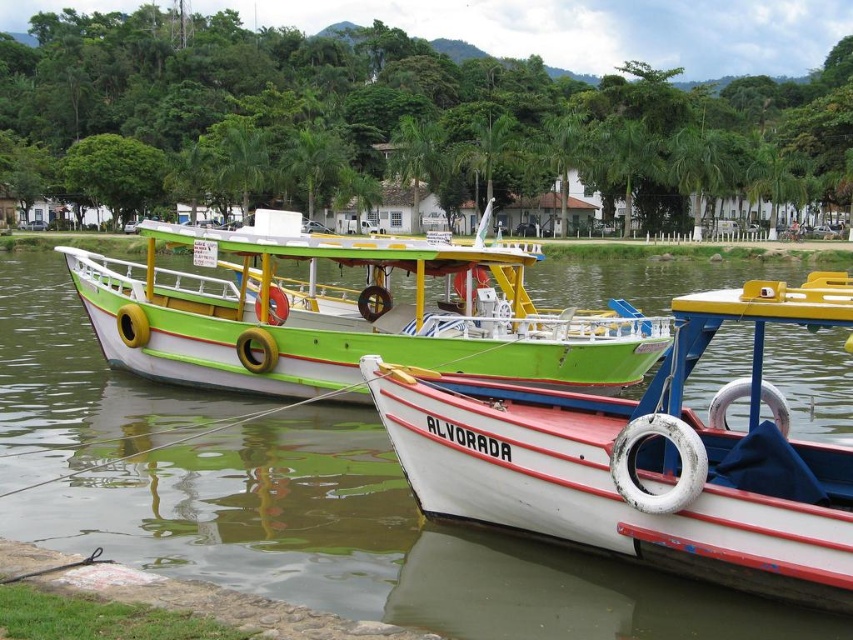
Question: Is white matte boat at lower right further to camera compared to green matte boat at center?

Choices:
 (A) yes
 (B) no

Answer: (B)

Question: Does white matte boat at lower right appear under green matte boat at center?

Choices:
 (A) yes
 (B) no

Answer: (A)

Question: Is white matte boat at lower right positioned before green matte boat at center?

Choices:
 (A) no
 (B) yes

Answer: (B)

Question: Which point appears farthest from the camera in this image?

Choices:
 (A) (766, 524)
 (B) (331, 394)

Answer: (B)

Question: Which of the following is the farthest from the observer?

Choices:
 (A) white matte boat at lower right
 (B) green matte boat at center

Answer: (B)